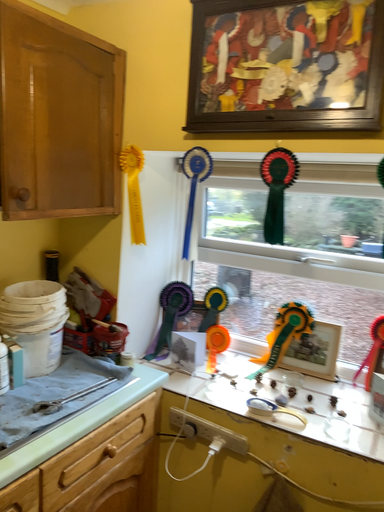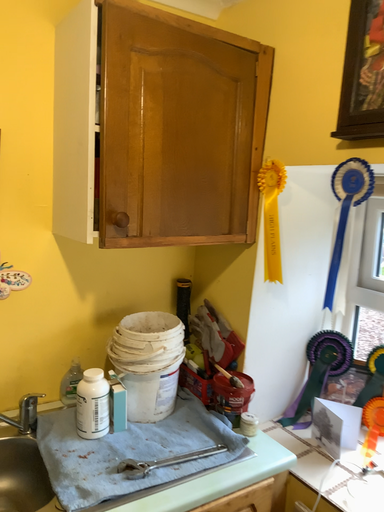
Question: Which way did the camera rotate in the video?

Choices:
 (A) rotated left
 (B) rotated right

Answer: (A)